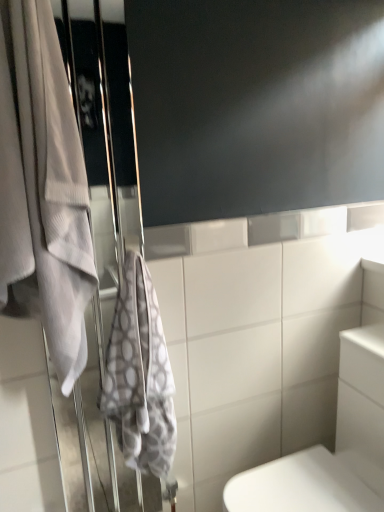
Question: Is white textured towel at left, arranged as the 2th towel when viewed from the right, taller or shorter than gray textured towel at left, marked as the first towel in a right-to-left arrangement?

Choices:
 (A) tall
 (B) short

Answer: (A)

Question: Is white textured towel at left, arranged as the 2th towel when viewed from the right, in front of or behind gray textured towel at left, which is the second towel from left to right, in the image?

Choices:
 (A) behind
 (B) front

Answer: (B)

Question: Considering the real-world distances, which object is closest to the white glossy toilet at lower right?

Choices:
 (A) white fabric screen door at left
 (B) gray textured towel at left, which is the second towel from left to right
 (C) white textured towel at left, arranged as the 2th towel when viewed from the right

Answer: (B)

Question: Which object is positioned farthest from the white textured towel at left, the 1th towel when ordered from left to right?

Choices:
 (A) white glossy toilet at lower right
 (B) gray textured towel at left, which is the second towel from left to right
 (C) white fabric screen door at left

Answer: (A)